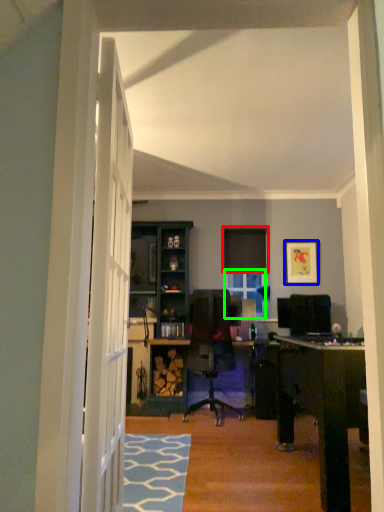
Question: Which is nearer to the curtain (highlighted by a red box)? picture frame (highlighted by a blue box) or window (highlighted by a green box).

Choices:
 (A) picture frame
 (B) window

Answer: (B)